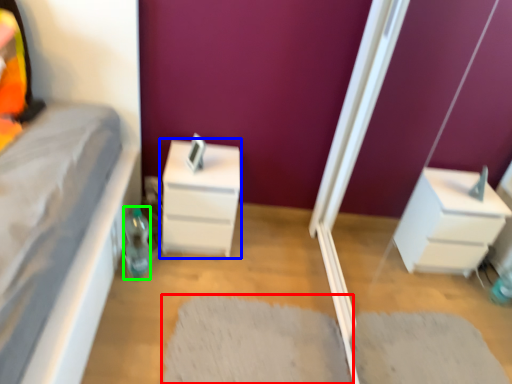
Question: Which object is the closest to the doormat (highlighted by a red box)? Choose among these: chest of drawers (highlighted by a blue box) or bottle (highlighted by a green box).

Choices:
 (A) chest of drawers
 (B) bottle

Answer: (A)